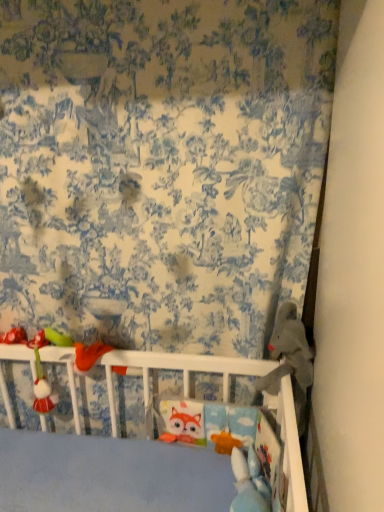
Question: Considering the relative sizes of blue printed fabric at upper center and gray plush bear at right, arranged as the second toy when viewed from the left, in the image provided, is blue printed fabric at upper center shorter than gray plush bear at right, arranged as the second toy when viewed from the left,?

Choices:
 (A) yes
 (B) no

Answer: (B)

Question: Is blue printed fabric at upper center turned away from gray plush bear at right, which is the 1th toy in right-to-left order?

Choices:
 (A) no
 (B) yes

Answer: (B)

Question: Is blue printed fabric at upper center outside gray plush bear at right, which is the 1th toy in right-to-left order?

Choices:
 (A) yes
 (B) no

Answer: (A)

Question: From a real-world perspective, is blue printed fabric at upper center below gray plush bear at right, which is the 1th toy in right-to-left order?

Choices:
 (A) no
 (B) yes

Answer: (A)

Question: Can you see blue printed fabric at upper center touching gray plush bear at right, which is the 1th toy in right-to-left order?

Choices:
 (A) yes
 (B) no

Answer: (B)

Question: From the image's perspective, is blue printed fabric at upper center under gray plush bear at right, which is the 1th toy in right-to-left order?

Choices:
 (A) no
 (B) yes

Answer: (A)

Question: Does matte plastic rattle at left, which appears as the second toy when viewed from the right, appear on the right side of blue printed fabric at upper center?

Choices:
 (A) yes
 (B) no

Answer: (B)

Question: Can you confirm if matte plastic rattle at left, which appears as the first toy when viewed from the left, is taller than blue printed fabric at upper center?

Choices:
 (A) no
 (B) yes

Answer: (A)

Question: Is matte plastic rattle at left, which appears as the first toy when viewed from the left, to the left of blue printed fabric at upper center from the viewer's perspective?

Choices:
 (A) no
 (B) yes

Answer: (B)

Question: Considering the relative sizes of matte plastic rattle at left, which appears as the first toy when viewed from the left, and blue printed fabric at upper center in the image provided, is matte plastic rattle at left, which appears as the first toy when viewed from the left, wider than blue printed fabric at upper center?

Choices:
 (A) no
 (B) yes

Answer: (B)

Question: Are matte plastic rattle at left, which appears as the first toy when viewed from the left, and blue printed fabric at upper center located far from each other?

Choices:
 (A) no
 (B) yes

Answer: (A)

Question: Is matte plastic rattle at left, which appears as the first toy when viewed from the left, completely or partially outside of blue printed fabric at upper center?

Choices:
 (A) yes
 (B) no

Answer: (A)

Question: Is blue printed fabric at upper center at the left side of matte plastic rattle at left, which appears as the first toy when viewed from the left?

Choices:
 (A) yes
 (B) no

Answer: (B)